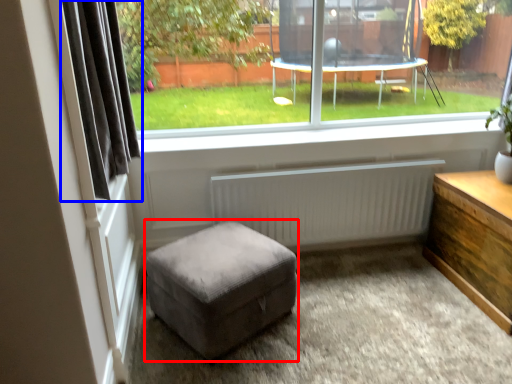
Question: Which object appears closest to the camera in this image, stool (highlighted by a red box) or curtain (highlighted by a blue box)?

Choices:
 (A) stool
 (B) curtain

Answer: (B)